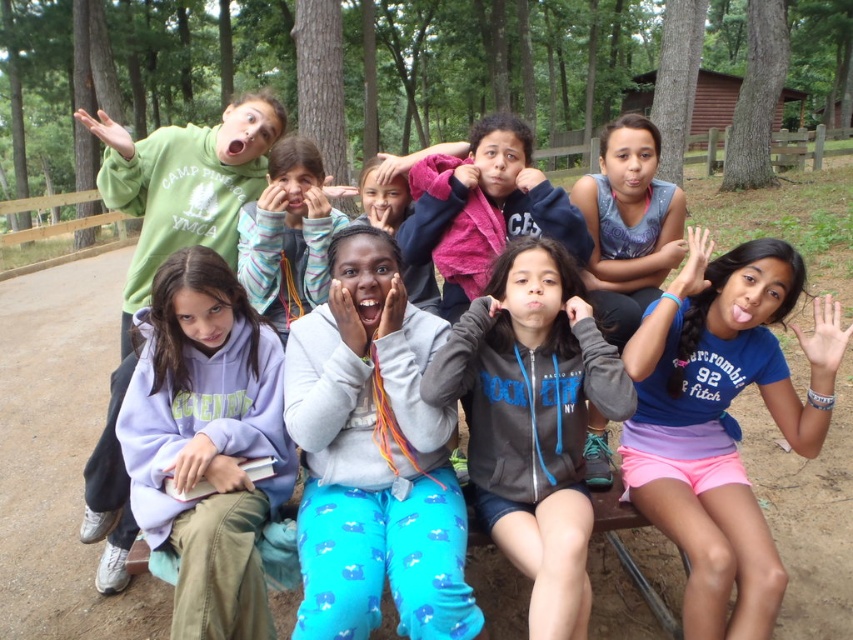
Which is below, purple fleece sweatshirt at left or striped fleece hoodie at center?

purple fleece sweatshirt at left is lower down.

Who is positioned more to the left, purple fleece sweatshirt at left or striped fleece hoodie at center?

purple fleece sweatshirt at left

Is point (177, 616) positioned after point (282, 282)?

No, (177, 616) is closer to viewer.

Locate an element on the screen. The image size is (853, 640). purple fleece sweatshirt at left is located at coordinates (206, 442).

Who is positioned more to the left, blue cotton shirt at center or purple fleece sweatshirt at left?

From the viewer's perspective, purple fleece sweatshirt at left appears more on the left side.

Can you confirm if blue cotton shirt at center is positioned above purple fleece sweatshirt at left?

Yes, blue cotton shirt at center is above purple fleece sweatshirt at left.

Is point (688, 580) behind point (235, 291)?

That is False.

The width and height of the screenshot is (853, 640). I want to click on blue cotton shirt at center, so click(722, 420).

Is light gray fleece sweatshirt at center below blue cotton shirt at center?

Incorrect, light gray fleece sweatshirt at center is not positioned below blue cotton shirt at center.

The height and width of the screenshot is (640, 853). In order to click on light gray fleece sweatshirt at center in this screenshot , I will do `click(373, 458)`.

Who is more forward, (343,522) or (695,520)?

Point (343,522)

Where is `light gray fleece sweatshirt at center`? This screenshot has height=640, width=853. light gray fleece sweatshirt at center is located at coordinates (373, 458).